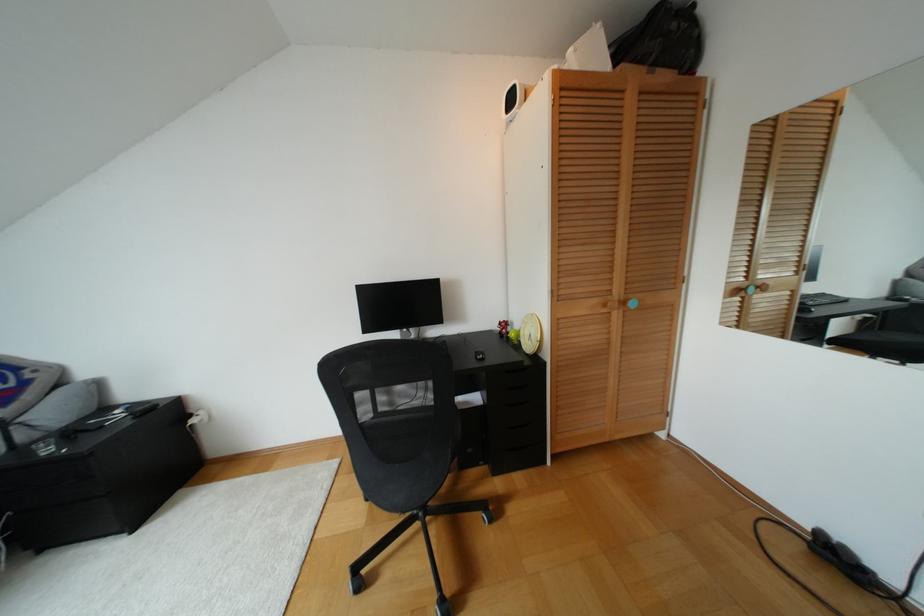
Image resolution: width=924 pixels, height=616 pixels. What do you see at coordinates (397, 438) in the screenshot? I see `the black chair seat` at bounding box center [397, 438].